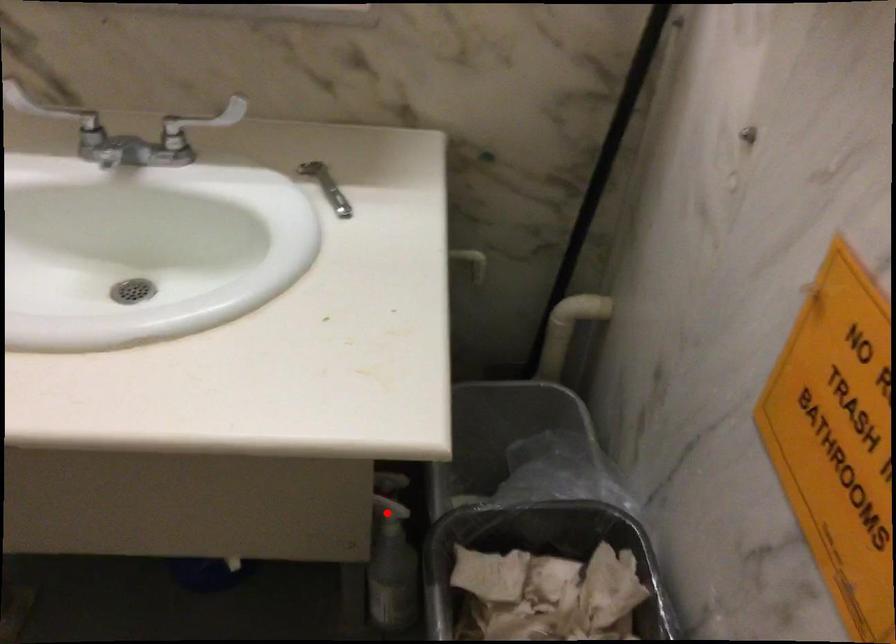
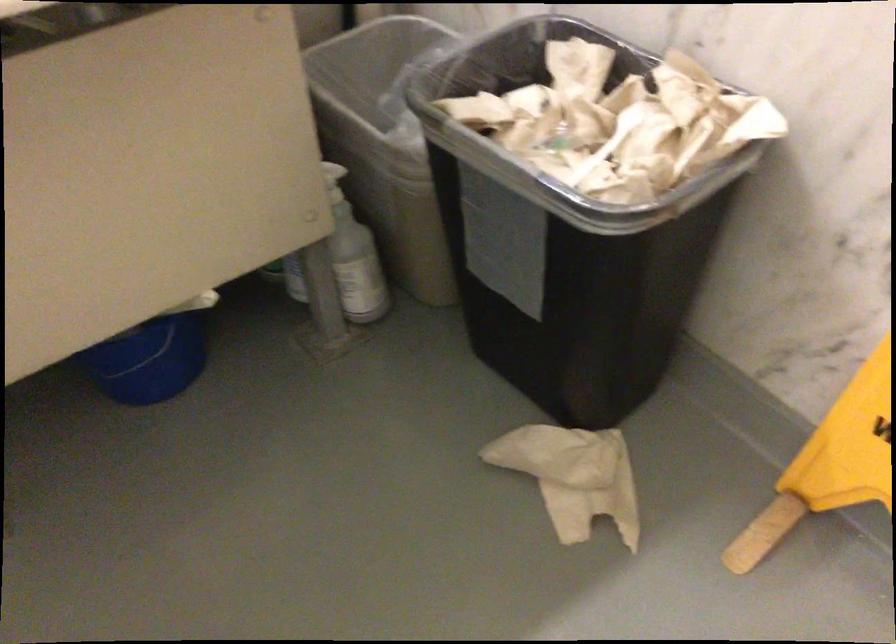
Find the pixel in the second image that matches the highlighted location in the first image.

(333, 182)